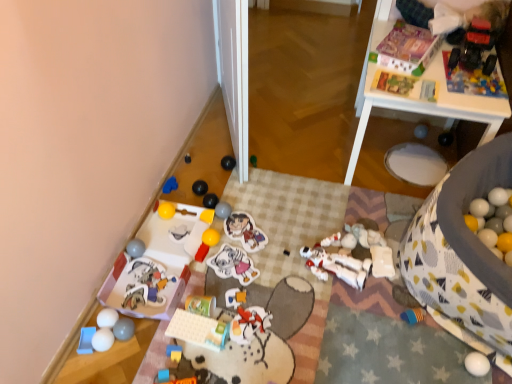
Question: From a real-world perspective, is rubber ball at center, which ranks as the seventeenth toy in left-to-right order, physically located above or below matte gray ball at lower left, positioned as the 24th toy in right-to-left order?

Choices:
 (A) above
 (B) below

Answer: (A)

Question: Considering the positions of point (219, 213) and point (134, 244), is point (219, 213) closer or farther from the camera than point (134, 244)?

Choices:
 (A) farther
 (B) closer

Answer: (A)

Question: Considering the real-world distances, which object is closest to the black rubber ball at center, which is the 18th toy from left to right?

Choices:
 (A) smooth plastic balls at lower left, the 23th toy when ordered from right to left
 (B) yellow rubber ball at lower left, which appears as the 20th toy when viewed from the right
 (C) rubber ball at center, which ranks as the seventeenth toy in left-to-right order
 (D) rubber yellow block at lower center, marked as the eleventh toy in a left-to-right arrangement
 (E) rubberized plastic toy truck at upper right, the first toy viewed from the right

Answer: (C)

Question: Estimate the real-world distances between objects in this image. Which object is closer to the matte plastic sticker at center, the 20th toy when ordered from left to right?

Choices:
 (A) green matte ball at center, which is the 6th toy in right-to-left order
 (B) plastic toy at lower left, marked as the 19th toy in a right-to-left arrangement
 (C) matte plastic toy at lower left, which appears as the 22th toy when viewed from the right
 (D) white matte sticker at center, which is the nineteenth toy from left to right
 (E) black rubber ball at center, the 12th toy from the left

Answer: (D)